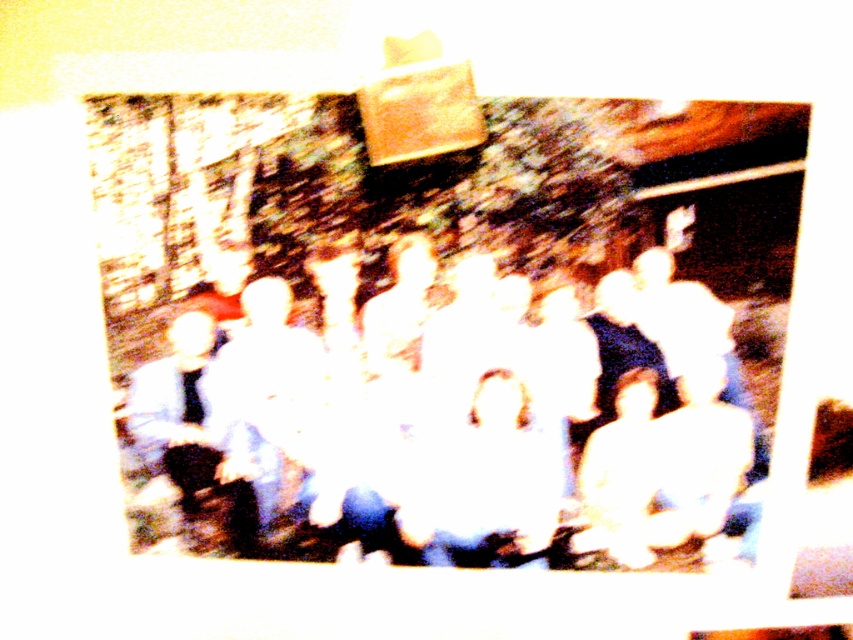
Question: Does white cotton shirt at center lie in front of white matte shirt at left?

Choices:
 (A) no
 (B) yes

Answer: (B)

Question: Is white cotton shirt at center thinner than white matte shirt at left?

Choices:
 (A) yes
 (B) no

Answer: (B)

Question: Which point is closer to the camera taking this photo?

Choices:
 (A) (144, 387)
 (B) (183, 474)

Answer: (A)

Question: Can you confirm if white cotton shirt at center is wider than white matte shirt at left?

Choices:
 (A) yes
 (B) no

Answer: (A)